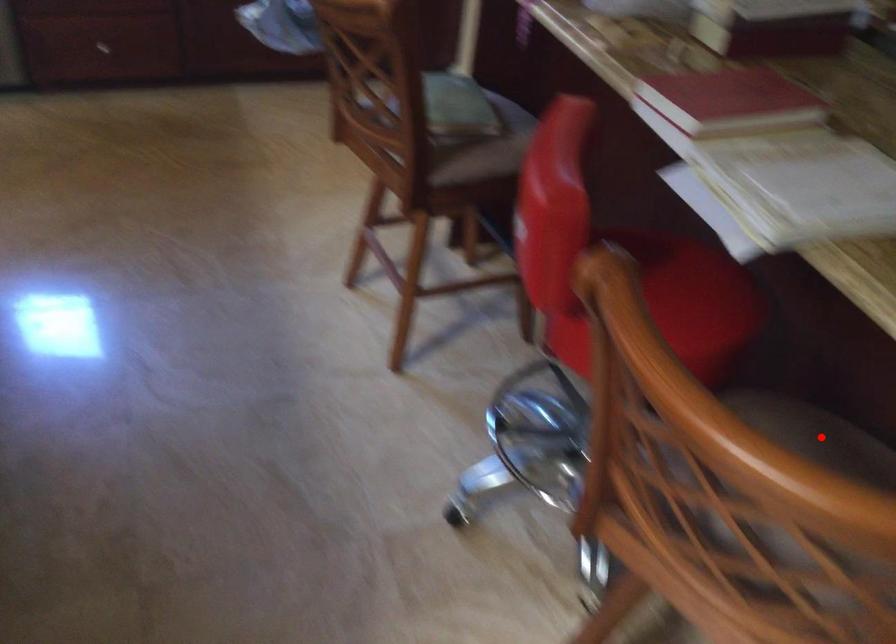
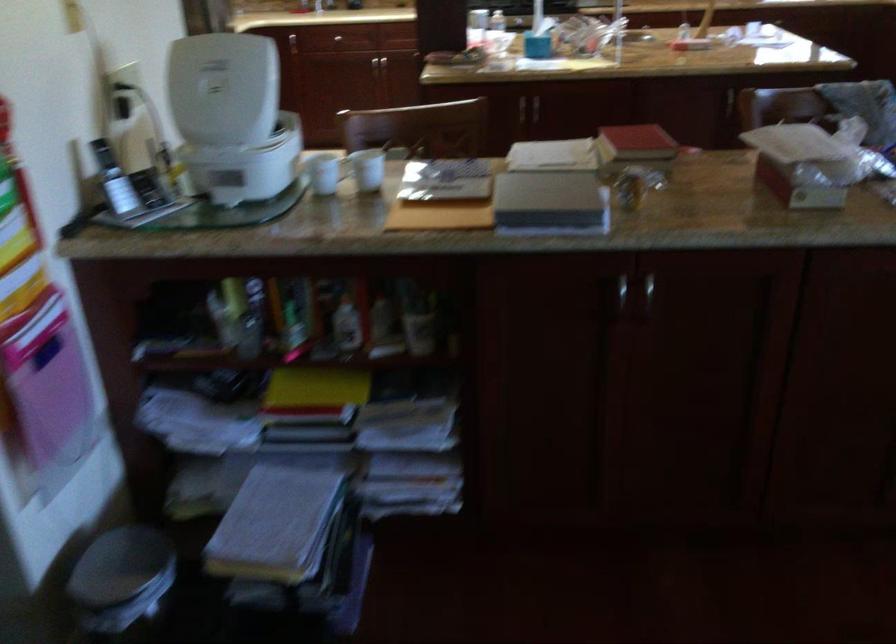
Question: I am providing you with two images of the same scene from different viewpoints. A red point is marked on the first image. At the location where the point appears in image 1, is it still visible in image 2?

Choices:
 (A) Yes
 (B) No

Answer: (B)